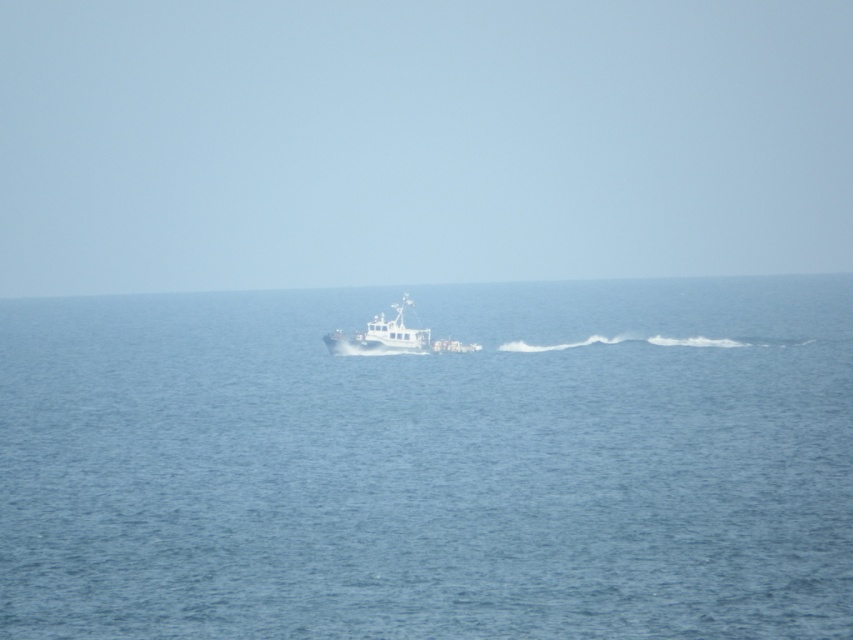
Question: Which point appears farthest from the camera in this image?

Choices:
 (A) (207, 365)
 (B) (354, 353)

Answer: (A)

Question: Is the position of blue water at center more distant than that of white matte boat at center?

Choices:
 (A) yes
 (B) no

Answer: (B)

Question: Which point is farther from the camera taking this photo?

Choices:
 (A) (x=368, y=324)
 (B) (x=56, y=339)

Answer: (B)

Question: Is blue water at center thinner than white matte boat at center?

Choices:
 (A) yes
 (B) no

Answer: (B)

Question: Does blue water at center appear over white matte boat at center?

Choices:
 (A) no
 (B) yes

Answer: (B)